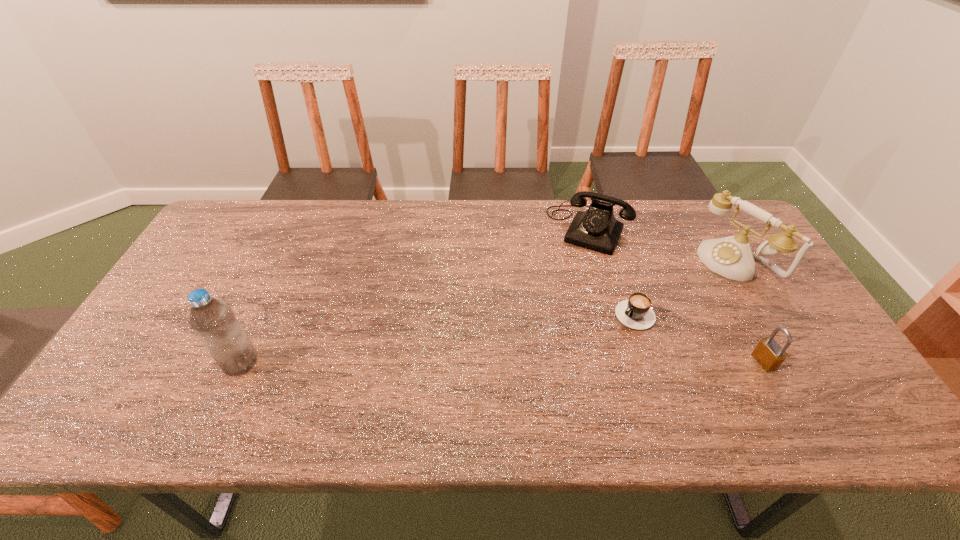
You are a GUI agent. You are given a task and a screenshot of the screen. Output one action in this format:
    pyautogui.click(x=<x>, y=<y>)
    Task: Click on the free spot on the desktop that is between the leftmost object and the padlock and is positioned on the dial of the taller telephone
    
    Given the screenshot: What is the action you would take?
    pyautogui.click(x=577, y=361)

This screenshot has height=540, width=960. What are the coordinates of `free space on the desktop that is between the leftmost object and the padlock and is positioned on the front face of the shorter telephone` in the screenshot? It's located at (525, 361).

This screenshot has width=960, height=540. I want to click on free spot on the desktop that is between the leftmost object and the padlock and is positioned with the handle on the side of the third farthest object, so click(x=577, y=361).